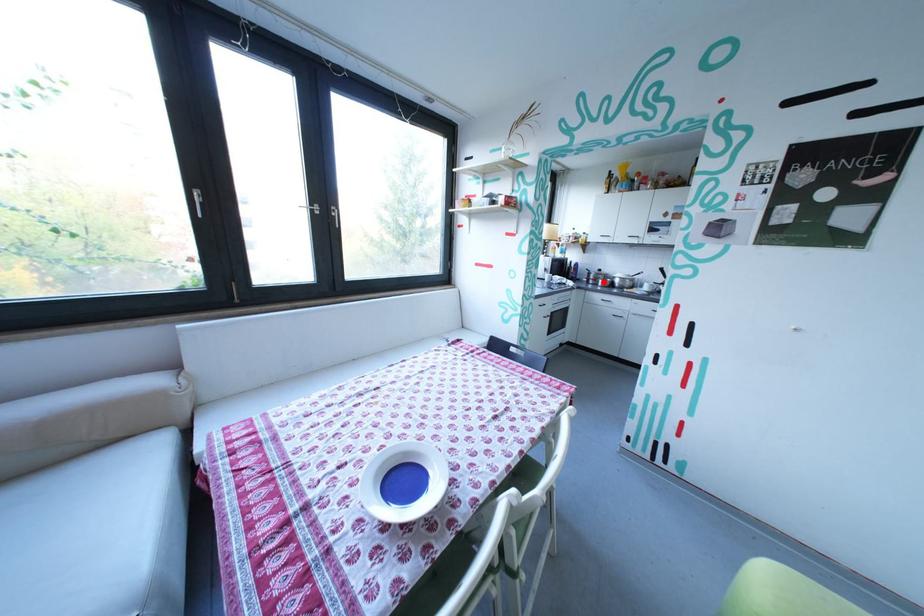
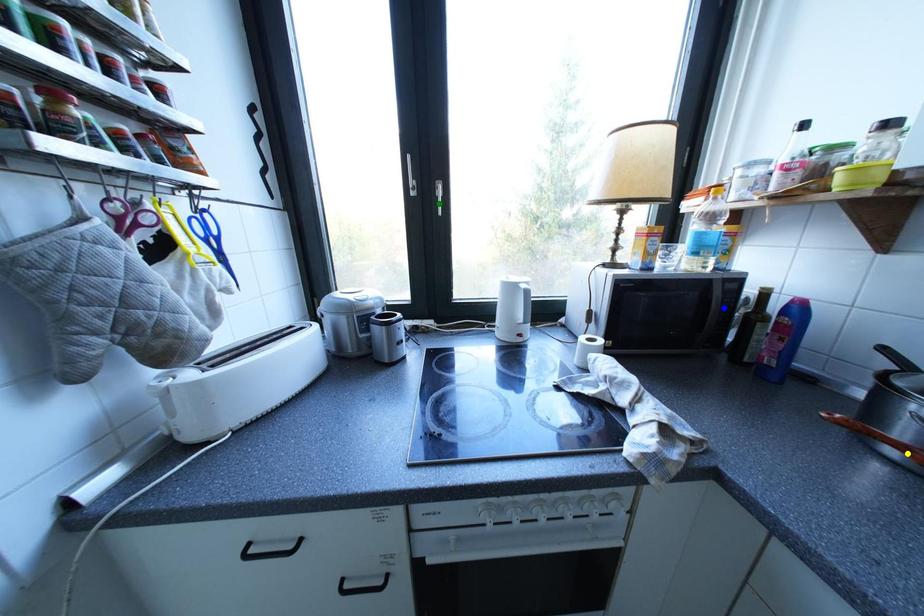
Question: I am providing you with two images of the same scene from different viewpoints. A red point is marked on the first image. You are given multiple points on the second image. In image 2, which mark is for the same physical point as the one in image 1?

Choices:
 (A) green point
 (B) blue point
 (C) yellow point

Answer: (C)